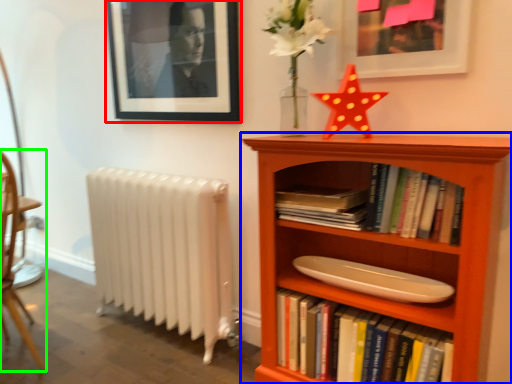
Question: Which is farther away from picture frame (highlighted by a red box)? bookcase (highlighted by a blue box) or chair (highlighted by a green box)?

Choices:
 (A) bookcase
 (B) chair

Answer: (B)